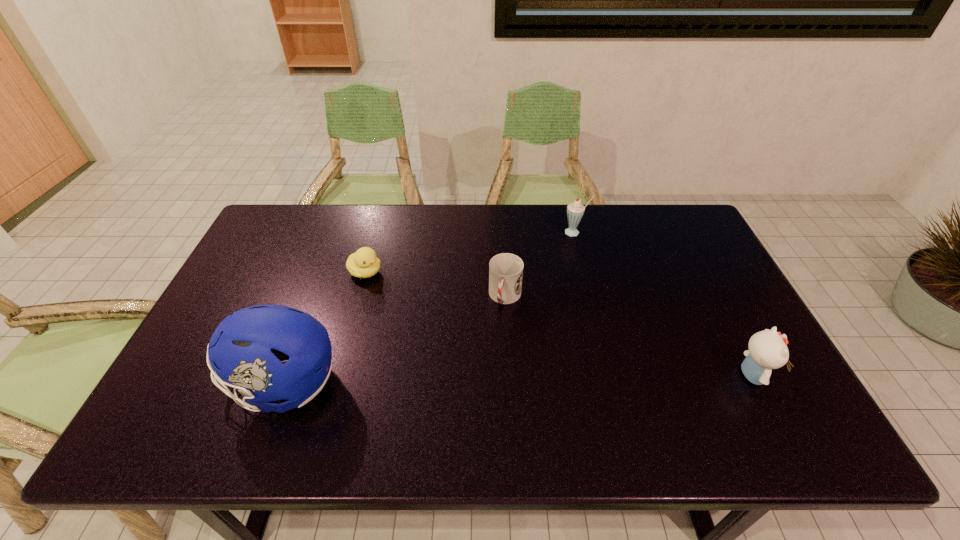
At what (x,y) coordinates should I click in order to perform the action: click on vacant area that lies between the fourth object from left to right and the cup. Please return your answer as a coordinate pair (x, y). This screenshot has height=540, width=960. Looking at the image, I should click on (540, 265).

Where is `vacant area between the rightmost object and the farthest object`? This screenshot has height=540, width=960. vacant area between the rightmost object and the farthest object is located at coordinates (663, 303).

Where is `empty space between the third object from left to right and the milkshake`? The width and height of the screenshot is (960, 540). empty space between the third object from left to right and the milkshake is located at coordinates (540, 265).

This screenshot has height=540, width=960. I want to click on unoccupied position between the football helmet and the third object from left to right, so click(x=395, y=341).

Identify which object is located as the nearest to the football helmet. Please provide its 2D coordinates. Your answer should be formatted as a tuple, i.e. [(x, y)], where the tuple contains the x and y coordinates of a point satisfying the conditions above.

[(364, 263)]

Identify which object is located as the second nearest to the duckling. Please provide its 2D coordinates. Your answer should be formatted as a tuple, i.e. [(x, y)], where the tuple contains the x and y coordinates of a point satisfying the conditions above.

[(505, 270)]

Find the location of `blank area in the image that satisfies the following two spatial constraints: 1. on the front side of the kitten; 2. on the front-facing side of the third object from right to left`. blank area in the image that satisfies the following two spatial constraints: 1. on the front side of the kitten; 2. on the front-facing side of the third object from right to left is located at coordinates (510, 375).